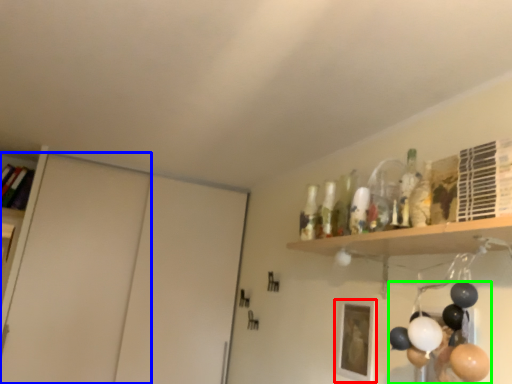
Question: Which object is positioned closest to picture frame (highlighted by a red box)? Select from door (highlighted by a blue box) and balloon (highlighted by a green box).

Choices:
 (A) door
 (B) balloon

Answer: (B)